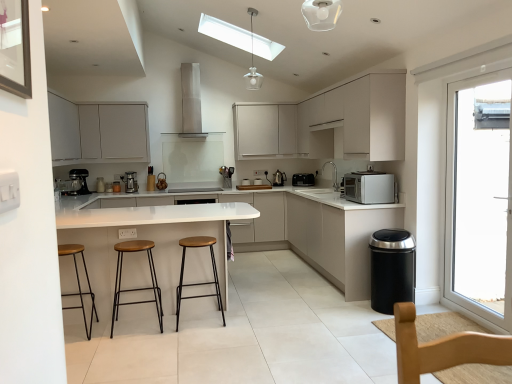
Identify the location of free location in front of satin white microwave at right, the first cabinetry positioned from the right. (303, 316).